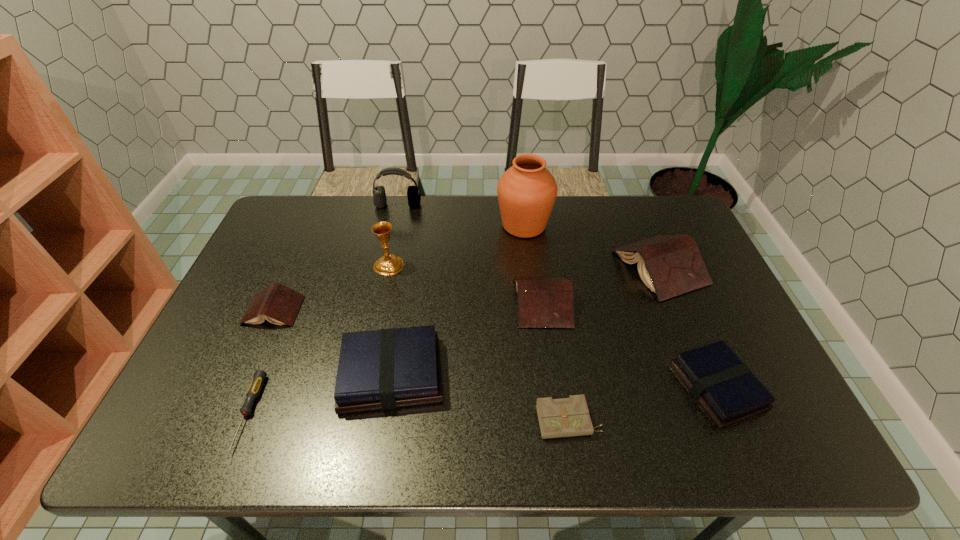
The height and width of the screenshot is (540, 960). I want to click on screwdriver situated at the near edge, so click(258, 379).

Locate an element on the screen. This screenshot has width=960, height=540. book that is at the left edge is located at coordinates (278, 304).

At what (x,y) coordinates should I click in order to perform the action: click on screwdriver at the left edge. Please return your answer as a coordinate pair (x, y). The image size is (960, 540). Looking at the image, I should click on (258, 379).

Find the location of a particular element. Image resolution: width=960 pixels, height=540 pixels. object that is at the near left corner is located at coordinates (258, 379).

I want to click on object that is positioned at the far right corner, so click(x=670, y=265).

Find the location of `object at the near right corner`. object at the near right corner is located at coordinates (725, 387).

In the image, there is a desktop. What are the coordinates of `vacant space at the far edge` in the screenshot? It's located at (400, 197).

Identify the location of free point at the near edge. (699, 431).

Find the location of `vacant area at the left edge of the desktop`. vacant area at the left edge of the desktop is located at coordinates (279, 268).

In the image, there is a desktop. Identify the location of vacant space at the far left corner. (310, 236).